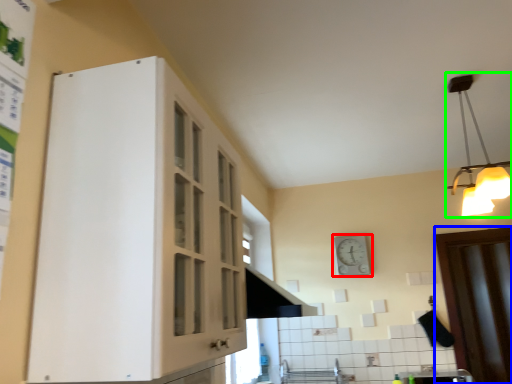
Question: Considering the real-world distances, which object is farthest from clock (highlighted by a red box)? door (highlighted by a blue box) or light fixture (highlighted by a green box)?

Choices:
 (A) door
 (B) light fixture

Answer: (B)